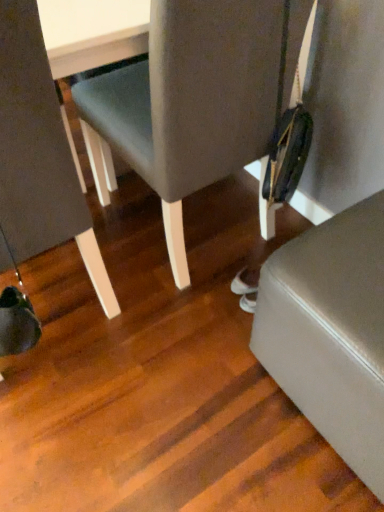
Question: From a real-world perspective, is satin silver knife at lower right physically located above or below matte gray chair at left, the 2th chair in the right-to-left sequence?

Choices:
 (A) above
 (B) below

Answer: (B)

Question: Is satin silver knife at lower right bigger or smaller than matte gray chair at left, the 2th chair in the right-to-left sequence?

Choices:
 (A) big
 (B) small

Answer: (B)

Question: Which of these objects is positioned farthest from the matte gray chair at left, the 2th chair in the right-to-left sequence?

Choices:
 (A) matte gray chair at center, the first chair positioned from the right
 (B) satin silver knife at lower right

Answer: (B)

Question: Which of these objects is positioned farthest from the matte gray chair at center, the first chair positioned from the right?

Choices:
 (A) satin silver knife at lower right
 (B) matte gray chair at left, the 2th chair in the right-to-left sequence

Answer: (A)